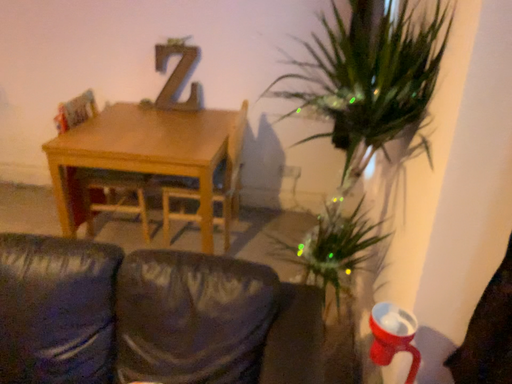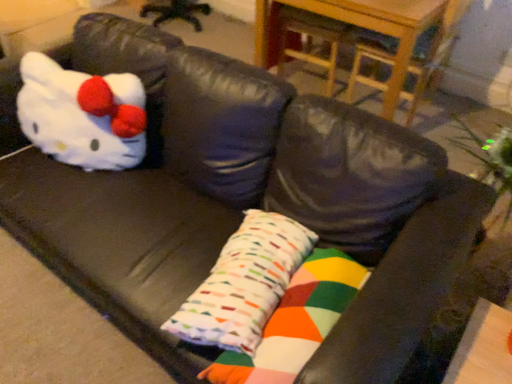
Question: How did the camera likely rotate when shooting the video?

Choices:
 (A) rotated downward
 (B) rotated upward

Answer: (A)